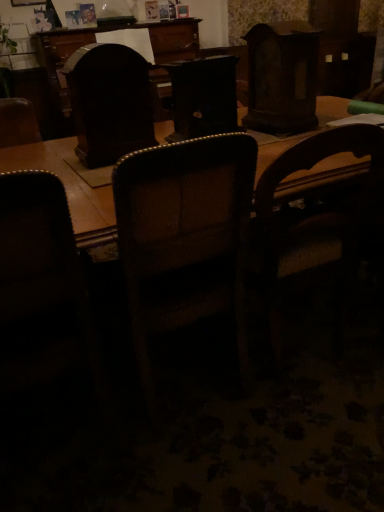
What do you see at coordinates (184, 238) in the screenshot?
I see `brown leather chair at center, arranged as the 2th chair when viewed from the right` at bounding box center [184, 238].

From the picture: Measure the distance between dark brown leather chair at left, the third chair from the right, and camera.

dark brown leather chair at left, the third chair from the right, and camera are 33.40 inches apart from each other.

This screenshot has width=384, height=512. What do you see at coordinates (314, 223) in the screenshot? I see `wooden chair at center, which appears as the 1th chair when viewed from the right` at bounding box center [314, 223].

Identify the location of wooden chair at center, which appears as the 1th chair when viewed from the right. (314, 223).

The width and height of the screenshot is (384, 512). What do you see at coordinates (109, 102) in the screenshot?
I see `dark wood swivel chair at center` at bounding box center [109, 102].

This screenshot has width=384, height=512. I want to click on dark wood swivel chair at center, so click(109, 102).

The height and width of the screenshot is (512, 384). I want to click on brown leather chair at center, arranged as the 2th chair when viewed from the right, so click(184, 238).

Which of these two, dark wood swivel chair at center or dark brown leather chair at left, the first chair when ordered from left to right, stands taller?

With more height is dark brown leather chair at left, the first chair when ordered from left to right.

Could you measure the distance between dark wood swivel chair at center and dark brown leather chair at left, the first chair when ordered from left to right?

They are 25.07 inches apart.

Would you consider dark wood swivel chair at center to be distant from dark brown leather chair at left, the first chair when ordered from left to right?

That's not correct — dark wood swivel chair at center is a little close to dark brown leather chair at left, the first chair when ordered from left to right.

Where is `chair on the left side of dark wood swivel chair at center`? The height and width of the screenshot is (512, 384). chair on the left side of dark wood swivel chair at center is located at coordinates (43, 291).

Consider the image. Is brown leather chair at center, arranged as the 2th chair when viewed from the right, at the back of dark brown leather chair at left, the third chair from the right?

dark brown leather chair at left, the third chair from the right, is not turned away from brown leather chair at center, arranged as the 2th chair when viewed from the right.

Is dark brown leather chair at left, the first chair when ordered from left to right, wider or thinner than brown leather chair at center, the 2th chair in the left-to-right sequence?

Considering their sizes, dark brown leather chair at left, the first chair when ordered from left to right, looks slimmer than brown leather chair at center, the 2th chair in the left-to-right sequence.

Does dark brown leather chair at left, the third chair from the right, lie in front of brown leather chair at center, arranged as the 2th chair when viewed from the right?

Yes, it is in front of brown leather chair at center, arranged as the 2th chair when viewed from the right.

Considering the positions of point (34, 318) and point (217, 271), is point (34, 318) closer or farther from the camera than point (217, 271)?

Point (34, 318) is positioned closer to the camera compared to point (217, 271).

Can you confirm if wooden chair at center, which appears as the 1th chair when viewed from the right, is positioned to the right of dark brown leather chair at left, the third chair from the right?

Correct, you'll find wooden chair at center, which appears as the 1th chair when viewed from the right, to the right of dark brown leather chair at left, the third chair from the right.

Consider the image. Which point is more forward, (310, 233) or (66, 308)?

The point (66, 308) is closer.

Is wooden chair at center, which appears as the 1th chair when viewed from the right, closer to camera compared to dark brown leather chair at left, the third chair from the right?

No, wooden chair at center, which appears as the 1th chair when viewed from the right, is behind dark brown leather chair at left, the third chair from the right.

Is wooden chair at center, which appears as the 1th chair when viewed from the right, facing away from dark brown leather chair at left, the first chair when ordered from left to right?

wooden chair at center, which appears as the 1th chair when viewed from the right, is not turned away from dark brown leather chair at left, the first chair when ordered from left to right.

Is wooden chair at center, which is counted as the 3th chair, starting from the left, aimed at dark wood swivel chair at center?

No, wooden chair at center, which is counted as the 3th chair, starting from the left, is not oriented towards dark wood swivel chair at center.

Considering the relative positions of wooden chair at center, which is counted as the 3th chair, starting from the left, and dark wood swivel chair at center in the image provided, is wooden chair at center, which is counted as the 3th chair, starting from the left, to the left of dark wood swivel chair at center from the viewer's perspective?

No.

Where is `the 1st chair in front of the dark wood swivel chair at center, starting your count from the anchor`? The height and width of the screenshot is (512, 384). the 1st chair in front of the dark wood swivel chair at center, starting your count from the anchor is located at coordinates (314, 223).

From a real-world perspective, is dark wood swivel chair at center under brown leather chair at center, arranged as the 2th chair when viewed from the right?

Actually, dark wood swivel chair at center is physically above brown leather chair at center, arranged as the 2th chair when viewed from the right, in the real world.

Considering the relative sizes of dark wood swivel chair at center and brown leather chair at center, the 2th chair in the left-to-right sequence, in the image provided, is dark wood swivel chair at center bigger than brown leather chair at center, the 2th chair in the left-to-right sequence,?

Actually, dark wood swivel chair at center might be smaller than brown leather chair at center, the 2th chair in the left-to-right sequence.

Is dark wood swivel chair at center facing away from brown leather chair at center, arranged as the 2th chair when viewed from the right?

Yes, dark wood swivel chair at center is positioned with its back facing brown leather chair at center, arranged as the 2th chair when viewed from the right.

From the image's perspective, which is below, dark wood swivel chair at center or brown leather chair at center, the 2th chair in the left-to-right sequence?

brown leather chair at center, the 2th chair in the left-to-right sequence, from the image's perspective.

Consider the image. Considering the relative positions of brown leather chair at center, arranged as the 2th chair when viewed from the right, and wooden chair at center, which is counted as the 3th chair, starting from the left, in the image provided, is brown leather chair at center, arranged as the 2th chair when viewed from the right, to the right of wooden chair at center, which is counted as the 3th chair, starting from the left, from the viewer's perspective?

No.

Is brown leather chair at center, arranged as the 2th chair when viewed from the right, smaller than wooden chair at center, which appears as the 1th chair when viewed from the right?

Incorrect, brown leather chair at center, arranged as the 2th chair when viewed from the right, is not smaller in size than wooden chair at center, which appears as the 1th chair when viewed from the right.

How distant is brown leather chair at center, arranged as the 2th chair when viewed from the right, from wooden chair at center, which is counted as the 3th chair, starting from the left?

brown leather chair at center, arranged as the 2th chair when viewed from the right, and wooden chair at center, which is counted as the 3th chair, starting from the left, are 9.93 inches apart.

Is there a large distance between brown leather chair at center, the 2th chair in the left-to-right sequence, and wooden chair at center, which is counted as the 3th chair, starting from the left?

No, brown leather chair at center, the 2th chair in the left-to-right sequence, is not far from wooden chair at center, which is counted as the 3th chair, starting from the left.

Is dark wood swivel chair at center not inside wooden chair at center, which is counted as the 3th chair, starting from the left?

Yes.

At what (x,y) coordinates should I click in order to perform the action: click on the 2nd chair counting from the right side of the dark wood swivel chair at center. Please return your answer as a coordinate pair (x, y). This screenshot has height=512, width=384. Looking at the image, I should click on (314, 223).

From the picture: Which is closer to the camera, (109, 46) or (272, 164)?

The point (272, 164) is more forward.

From the image's perspective, does dark wood swivel chair at center appear higher than wooden chair at center, which appears as the 1th chair when viewed from the right?

Yes, from the image's perspective, dark wood swivel chair at center is above wooden chair at center, which appears as the 1th chair when viewed from the right.

From the image's perspective, count 3rd chairs downward from the dark wood swivel chair at center and point to it. Please provide its 2D coordinates.

[(43, 291)]

There is a dark brown leather chair at left, the third chair from the right. Find the location of `the 1st chair above it (from the image's perspective)`. the 1st chair above it (from the image's perspective) is located at coordinates (184, 238).

When comparing their distances from wooden chair at center, which is counted as the 3th chair, starting from the left, does dark brown leather chair at left, the first chair when ordered from left to right, or brown leather chair at center, arranged as the 2th chair when viewed from the right, seem closer?

brown leather chair at center, arranged as the 2th chair when viewed from the right, lies closer to wooden chair at center, which is counted as the 3th chair, starting from the left, than the other object.

Which object lies further to the anchor point brown leather chair at center, the 2th chair in the left-to-right sequence, wooden chair at center, which appears as the 1th chair when viewed from the right, or dark wood swivel chair at center?

dark wood swivel chair at center.

When comparing their distances from dark brown leather chair at left, the third chair from the right, does wooden chair at center, which appears as the 1th chair when viewed from the right, or dark wood swivel chair at center seem closer?

The object closer to dark brown leather chair at left, the third chair from the right, is dark wood swivel chair at center.

Looking at the image, which one is located closer to brown leather chair at center, the 2th chair in the left-to-right sequence, wooden chair at center, which is counted as the 3th chair, starting from the left, or dark brown leather chair at left, the third chair from the right?

The object closer to brown leather chair at center, the 2th chair in the left-to-right sequence, is wooden chair at center, which is counted as the 3th chair, starting from the left.

Which object lies nearer to the anchor point brown leather chair at center, the 2th chair in the left-to-right sequence, dark brown leather chair at left, the first chair when ordered from left to right, or wooden chair at center, which is counted as the 3th chair, starting from the left?

Based on the image, wooden chair at center, which is counted as the 3th chair, starting from the left, appears to be nearer to brown leather chair at center, the 2th chair in the left-to-right sequence.

Which object lies further to the anchor point dark wood swivel chair at center, brown leather chair at center, arranged as the 2th chair when viewed from the right, or wooden chair at center, which appears as the 1th chair when viewed from the right?

wooden chair at center, which appears as the 1th chair when viewed from the right, is positioned further to the anchor dark wood swivel chair at center.

Based on their spatial positions, is brown leather chair at center, the 2th chair in the left-to-right sequence, or dark brown leather chair at left, the third chair from the right, further from wooden chair at center, which is counted as the 3th chair, starting from the left?

dark brown leather chair at left, the third chair from the right.

Based on the photo, looking at the image, which one is located further to wooden chair at center, which is counted as the 3th chair, starting from the left, dark wood swivel chair at center or dark brown leather chair at left, the first chair when ordered from left to right?

The object further to wooden chair at center, which is counted as the 3th chair, starting from the left, is dark brown leather chair at left, the first chair when ordered from left to right.

Where is `swivel chair between dark brown leather chair at left, the third chair from the right, and wooden chair at center, which is counted as the 3th chair, starting from the left`? The height and width of the screenshot is (512, 384). swivel chair between dark brown leather chair at left, the third chair from the right, and wooden chair at center, which is counted as the 3th chair, starting from the left is located at coordinates (109, 102).

Find the location of a particular element. chair between dark brown leather chair at left, the third chair from the right, and wooden chair at center, which is counted as the 3th chair, starting from the left, from left to right is located at coordinates (184, 238).

Find the location of a particular element. chair between dark wood swivel chair at center and wooden chair at center, which is counted as the 3th chair, starting from the left, in the horizontal direction is located at coordinates (184, 238).